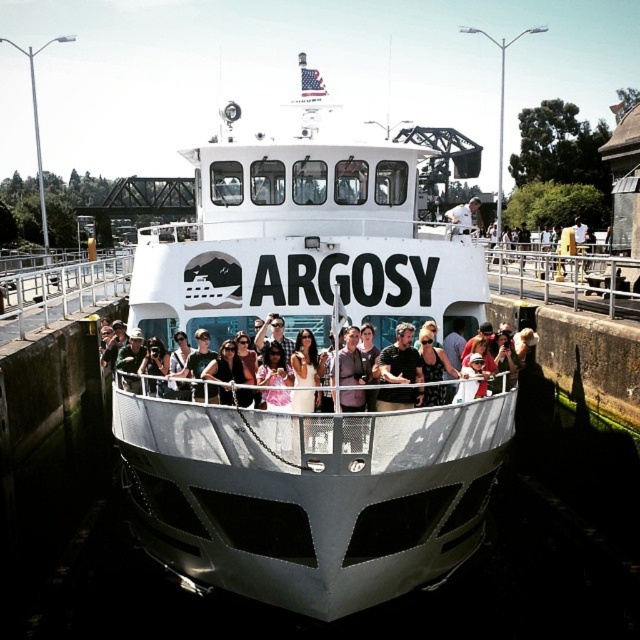
Question: Considering the relative positions of white matte boat at center and dark gray shirt at center in the image provided, where is white matte boat at center located with respect to dark gray shirt at center?

Choices:
 (A) below
 (B) above

Answer: (B)

Question: Which object appears farthest from the camera in this image?

Choices:
 (A) white fabric shirt at center
 (B) matte black shirt at center

Answer: (A)

Question: Among these points, which one is nearest to the camera?

Choices:
 (A) (216, 388)
 (B) (413, 358)
 (C) (460, 204)
 (D) (138, 474)

Answer: (A)

Question: Is white matte boat at center bigger than matte black shirt at center?

Choices:
 (A) yes
 (B) no

Answer: (A)

Question: Is white matte boat at center above dark gray shirt at center?

Choices:
 (A) no
 (B) yes

Answer: (B)

Question: Based on their relative distances, which object is nearer to the dark gray shirt at center?

Choices:
 (A) white matte boat at center
 (B) white fabric shirt at center

Answer: (A)